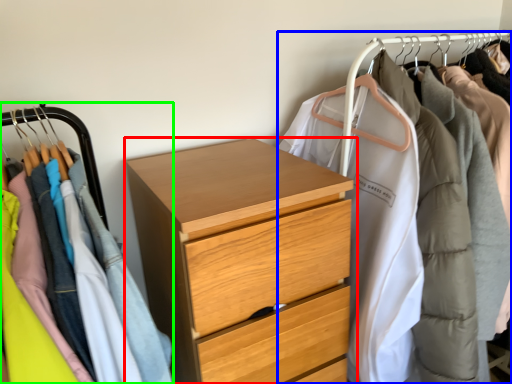
Question: Estimate the real-world distances between objects in this image. Which object is closer to chest of drawers (highlighted by a red box), closet (highlighted by a blue box) or closet (highlighted by a green box)?

Choices:
 (A) closet
 (B) closet

Answer: (B)